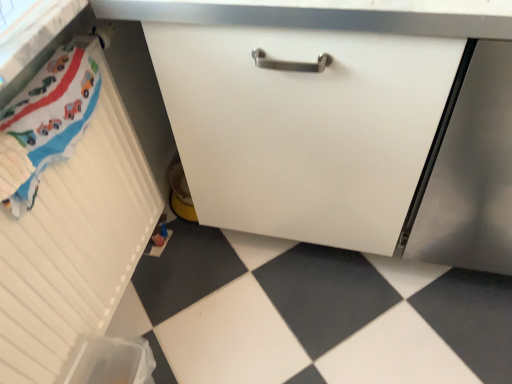
Find the location of `unoccupied area in front of white matte cabinet at center, which ranks as the 1th cabinetry in right-to-left order`. unoccupied area in front of white matte cabinet at center, which ranks as the 1th cabinetry in right-to-left order is located at coordinates (301, 314).